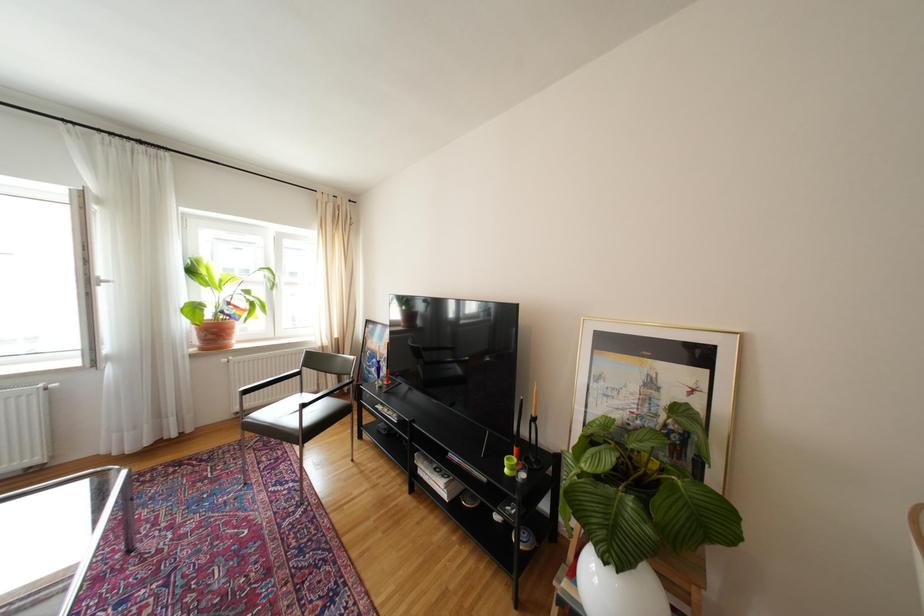
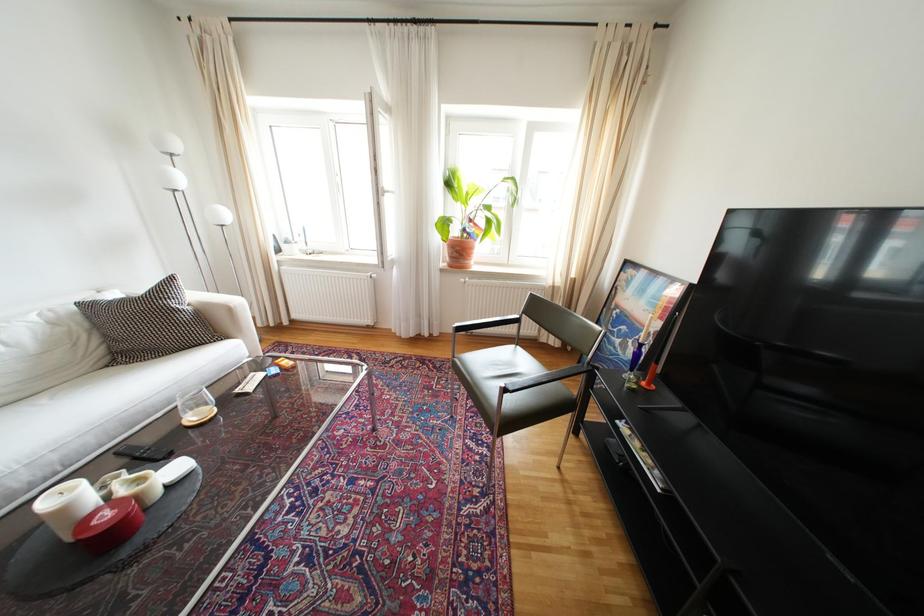
The images are taken continuously from a first-person perspective. In which direction is your viewpoint rotating?

The camera's rotation is toward left-down.